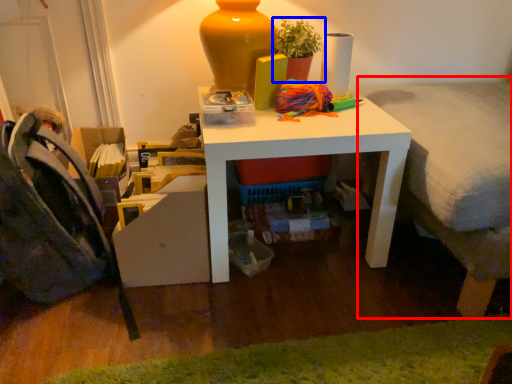
Question: Which object appears closest to the camera in this image, bed (highlighted by a red box) or houseplant (highlighted by a blue box)?

Choices:
 (A) bed
 (B) houseplant

Answer: (A)